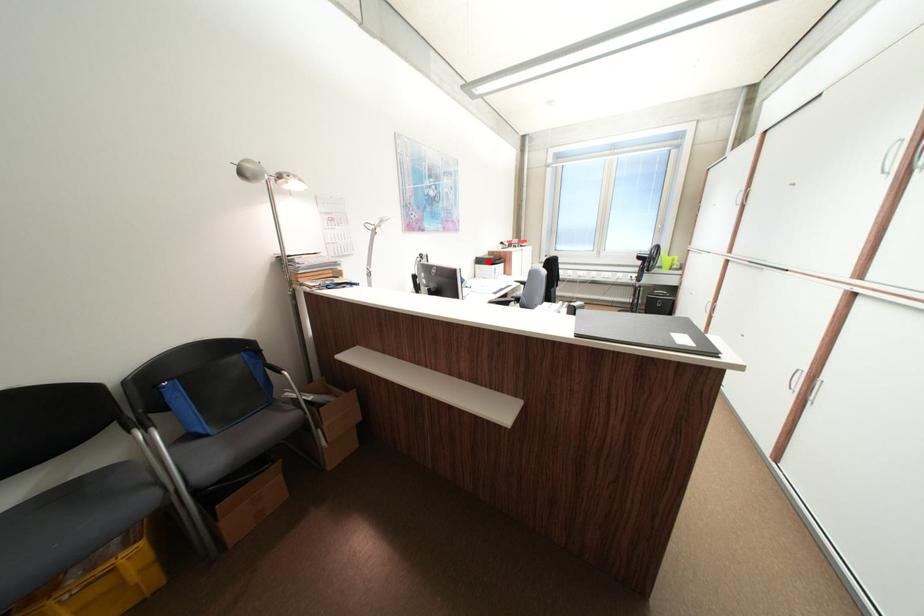
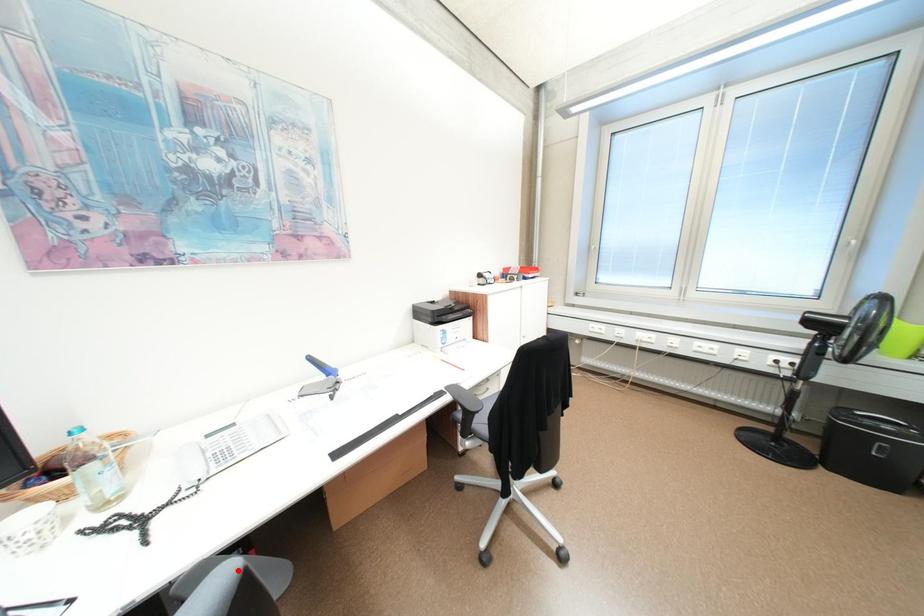
I am providing you with two images of the same scene from different viewpoints. A red point is marked on the first image and another point is marked on the second image. Are the points marked in image1 and image2 representing the same 3D position?

No